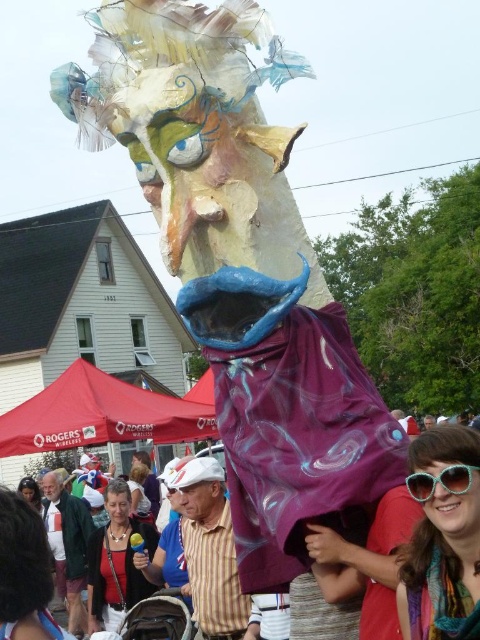
Does metallic silver umbrella at center have a lesser height compared to sunglasses at lower right?

No.

Which is behind, point (397, 572) or point (468, 477)?

Point (397, 572)

Measure the distance between metallic silver umbrella at center and camera.

metallic silver umbrella at center and camera are 32.31 feet apart from each other.

This screenshot has height=640, width=480. In order to click on metallic silver umbrella at center in this screenshot , I will do `click(409, 561)`.